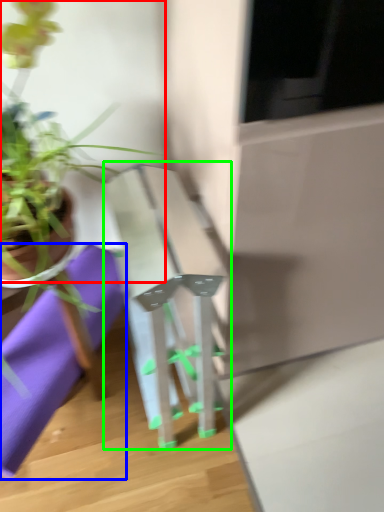
Question: Which is nearer to the houseplant (highlighted by a red box)? cloth (highlighted by a blue box) or table (highlighted by a green box).

Choices:
 (A) cloth
 (B) table

Answer: (A)